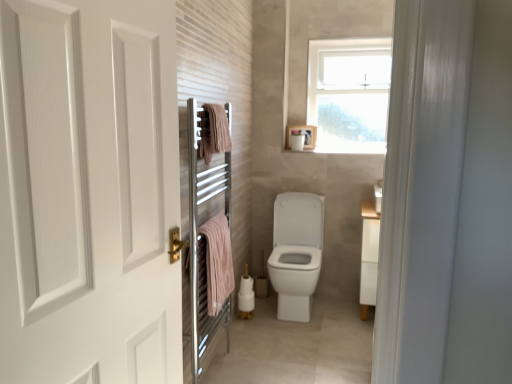
Question: Should I look upward or downward to see pink cotton towel at left, which is the first bath towel in bottom-to-top order?

Choices:
 (A) down
 (B) up

Answer: (A)

Question: From a real-world perspective, is white matte door at left beneath pink cotton towel at left, which is the first bath towel in bottom-to-top order?

Choices:
 (A) no
 (B) yes

Answer: (A)

Question: Is white matte door at left to the right of pink cotton towel at left, which is the first bath towel in bottom-to-top order, from the viewer's perspective?

Choices:
 (A) no
 (B) yes

Answer: (A)

Question: Considering the relative sizes of white matte door at left and pink cotton towel at left, which is the first bath towel in bottom-to-top order, in the image provided, is white matte door at left taller than pink cotton towel at left, which is the first bath towel in bottom-to-top order,?

Choices:
 (A) no
 (B) yes

Answer: (B)

Question: Is white matte door at left outside of pink cotton towel at left, which is the first bath towel in bottom-to-top order?

Choices:
 (A) no
 (B) yes

Answer: (B)

Question: Considering the relative sizes of white matte door at left and pink cotton towel at left, which is the first bath towel in bottom-to-top order, in the image provided, is white matte door at left thinner than pink cotton towel at left, which is the first bath towel in bottom-to-top order,?

Choices:
 (A) no
 (B) yes

Answer: (A)

Question: Is the position of white matte door at left more distant than that of pink cotton towel at left, which is the first bath towel in bottom-to-top order?

Choices:
 (A) yes
 (B) no

Answer: (B)

Question: Is chrome metallic towel warmer at left surrounding white matte toilet paper at upper center?

Choices:
 (A) no
 (B) yes

Answer: (A)

Question: Can you see chrome metallic towel warmer at left touching white matte toilet paper at upper center?

Choices:
 (A) yes
 (B) no

Answer: (B)

Question: Does chrome metallic towel warmer at left lie in front of white matte toilet paper at upper center?

Choices:
 (A) no
 (B) yes

Answer: (B)

Question: Is chrome metallic towel warmer at left taller than white matte toilet paper at upper center?

Choices:
 (A) no
 (B) yes

Answer: (B)

Question: Can you confirm if chrome metallic towel warmer at left is bigger than white matte toilet paper at upper center?

Choices:
 (A) yes
 (B) no

Answer: (A)

Question: Considering the relative sizes of chrome metallic towel warmer at left and white matte toilet paper at upper center in the image provided, is chrome metallic towel warmer at left thinner than white matte toilet paper at upper center?

Choices:
 (A) no
 (B) yes

Answer: (B)

Question: Considering the relative sizes of chrome metallic towel warmer at left and pink cotton towel at left, which is the first bath towel in bottom-to-top order, in the image provided, is chrome metallic towel warmer at left taller than pink cotton towel at left, which is the first bath towel in bottom-to-top order,?

Choices:
 (A) no
 (B) yes

Answer: (B)